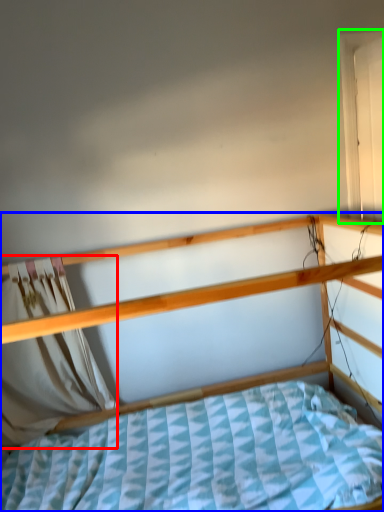
Question: Which object is the closest to the curtain (highlighted by a red box)? Choose among these: bed (highlighted by a blue box) or window (highlighted by a green box).

Choices:
 (A) bed
 (B) window

Answer: (A)